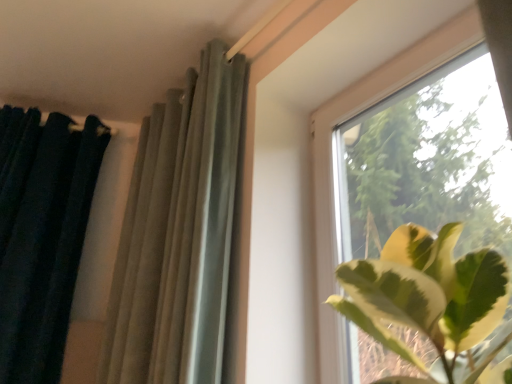
Question: Is dark green velvet curtain at left, which is counted as the first curtain, starting from the left, bigger than transparent glass window at upper right?

Choices:
 (A) yes
 (B) no

Answer: (A)

Question: Is dark green velvet curtain at left, which is counted as the first curtain, starting from the left, taller than transparent glass window at upper right?

Choices:
 (A) no
 (B) yes

Answer: (B)

Question: Does dark green velvet curtain at left, positioned as the 2th curtain in right-to-left order, lie behind transparent glass window at upper right?

Choices:
 (A) yes
 (B) no

Answer: (A)

Question: Is there a large distance between dark green velvet curtain at left, positioned as the 2th curtain in right-to-left order, and transparent glass window at upper right?

Choices:
 (A) yes
 (B) no

Answer: (A)

Question: Is transparent glass window at upper right at the back of dark green velvet curtain at left, which is counted as the first curtain, starting from the left?

Choices:
 (A) no
 (B) yes

Answer: (A)

Question: Is dark green velvet curtain at left, positioned as the 2th curtain in right-to-left order, surrounding transparent glass window at upper right?

Choices:
 (A) no
 (B) yes

Answer: (A)

Question: Considering the relative sizes of transparent glass window at upper right and satin gray curtain at upper center, which ranks as the first curtain in right-to-left order, in the image provided, is transparent glass window at upper right thinner than satin gray curtain at upper center, which ranks as the first curtain in right-to-left order,?

Choices:
 (A) no
 (B) yes

Answer: (B)

Question: From the image's perspective, would you say transparent glass window at upper right is shown under satin gray curtain at upper center, which ranks as the first curtain in right-to-left order?

Choices:
 (A) yes
 (B) no

Answer: (B)

Question: From a real-world perspective, is transparent glass window at upper right positioned under satin gray curtain at upper center, which ranks as the first curtain in right-to-left order, based on gravity?

Choices:
 (A) yes
 (B) no

Answer: (A)

Question: Is transparent glass window at upper right touching satin gray curtain at upper center, which ranks as the first curtain in right-to-left order?

Choices:
 (A) no
 (B) yes

Answer: (A)

Question: Is transparent glass window at upper right shorter than satin gray curtain at upper center, the 2th curtain when ordered from left to right?

Choices:
 (A) yes
 (B) no

Answer: (A)

Question: From the image's perspective, is transparent glass window at upper right on top of satin gray curtain at upper center, the 2th curtain when ordered from left to right?

Choices:
 (A) no
 (B) yes

Answer: (B)

Question: From a real-world perspective, does satin gray curtain at upper center, which ranks as the first curtain in right-to-left order, stand above dark green velvet curtain at left, positioned as the 2th curtain in right-to-left order?

Choices:
 (A) yes
 (B) no

Answer: (A)